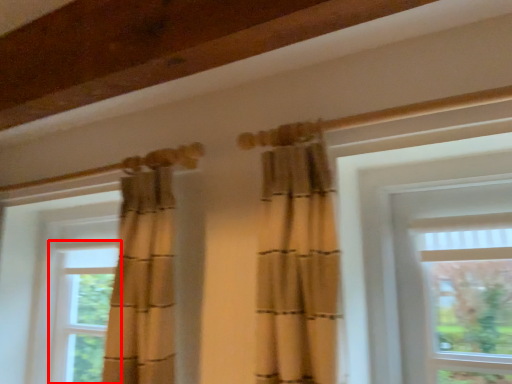
Question: From the image, what is the correct spatial relationship of window (annotated by the red box) in relation to window?

Choices:
 (A) right
 (B) left

Answer: (B)